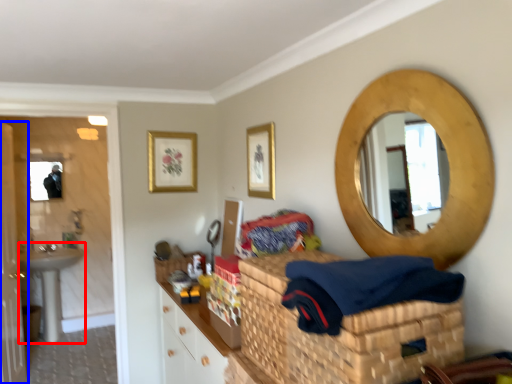
Question: Among these objects, which one is nearest to the camera, sink (highlighted by a red box) or door (highlighted by a blue box)?

Choices:
 (A) sink
 (B) door

Answer: (B)